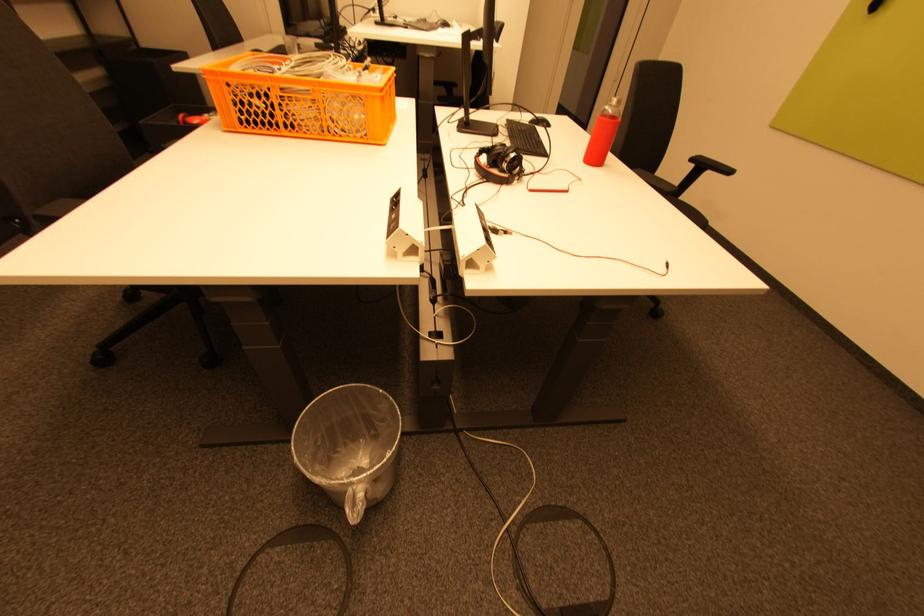
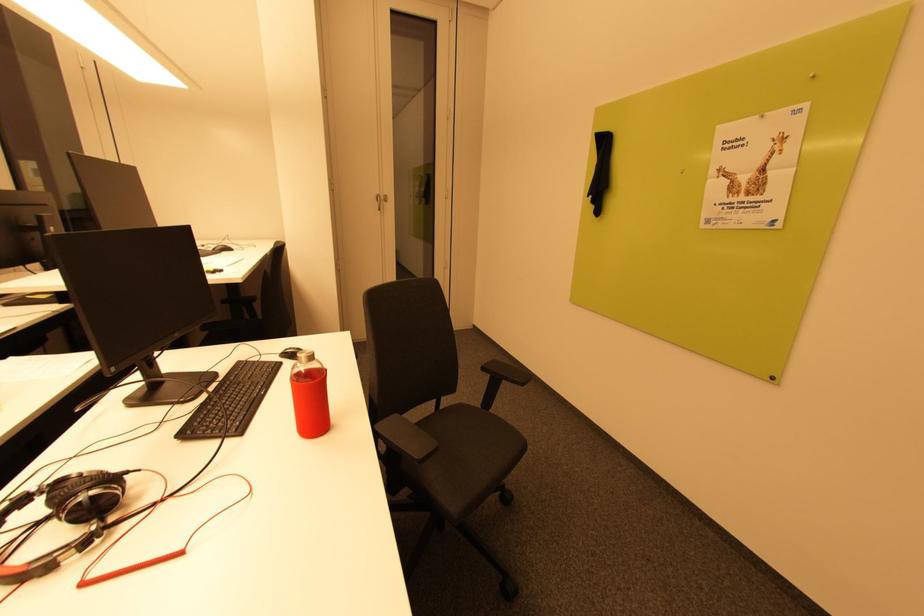
What movement of the cameraman would produce the second image?

The cameraman walked toward right, forward.